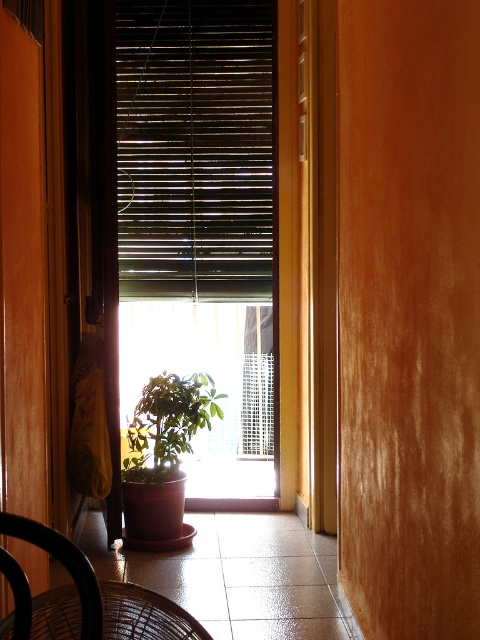
Question: Is wooden blinds at center bigger than black wire chair at lower left?

Choices:
 (A) yes
 (B) no

Answer: (A)

Question: Among these points, which one is nearest to the camera?

Choices:
 (A) (205, 188)
 (B) (182, 392)
 (C) (59, 532)
 (D) (46, 612)

Answer: (C)

Question: Which of the following is the farthest from the observer?

Choices:
 (A) (156, 406)
 (B) (44, 525)
 (C) (104, 618)

Answer: (A)

Question: Is wooden blinds at center wider than green matte plant at lower center?

Choices:
 (A) yes
 (B) no

Answer: (A)

Question: Which point is closer to the camera?

Choices:
 (A) (243, 173)
 (B) (141, 589)
 (C) (172, 413)

Answer: (B)

Question: In this image, where is wooden blinds at center located relative to black wire chair at lower left?

Choices:
 (A) above
 (B) below

Answer: (A)